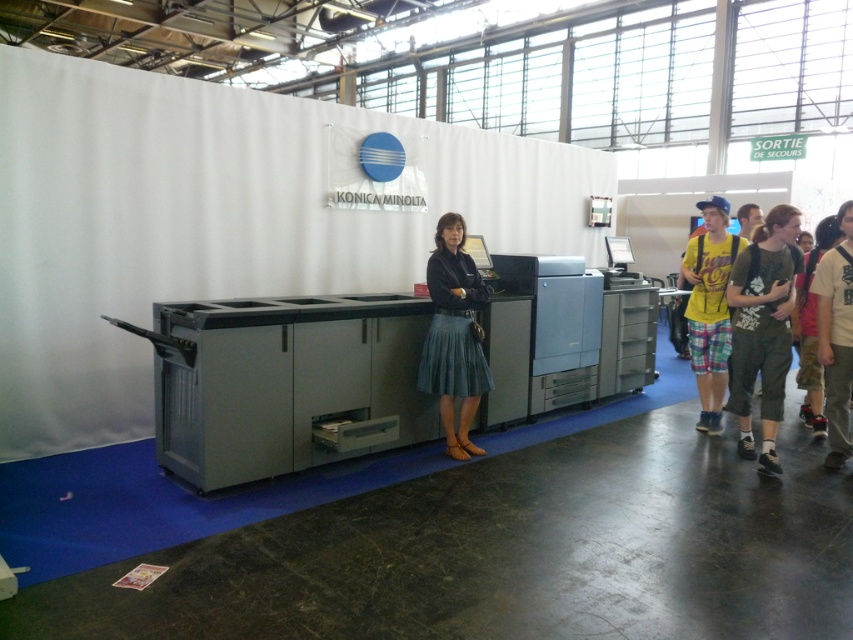
Is dark gray cotton pants at right thinner than blue denim jeans at center?

No.

Is point (752, 314) positioned in front of point (751, 204)?

Yes, point (752, 314) is in front of point (751, 204).

Locate an element on the screen. dark gray cotton pants at right is located at coordinates (762, 326).

Does yellow cotton shirt at right have a lesser width compared to white cotton t-shirt at right?

Indeed, yellow cotton shirt at right has a lesser width compared to white cotton t-shirt at right.

Does point (695, 324) lie behind point (846, 236)?

Yes, point (695, 324) is farther from viewer.

The width and height of the screenshot is (853, 640). What are the coordinates of `yellow cotton shirt at right` in the screenshot? It's located at (709, 308).

Between dark gray cotton pants at right and white cotton t-shirt at right, which one is positioned higher?

Positioned higher is white cotton t-shirt at right.

Looking at this image, can you confirm if dark gray cotton pants at right is positioned above white cotton t-shirt at right?

No, dark gray cotton pants at right is not above white cotton t-shirt at right.

Is point (782, 218) positioned after point (833, 342)?

No, (782, 218) is in front of (833, 342).

Find the location of `dark gray cotton pants at right`. dark gray cotton pants at right is located at coordinates (762, 326).